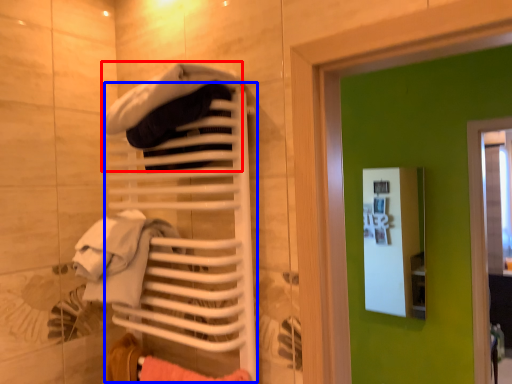
Question: Which point is closer to the camera, clothing (highlighted by a red box) or closet (highlighted by a blue box)?

Choices:
 (A) clothing
 (B) closet

Answer: (A)